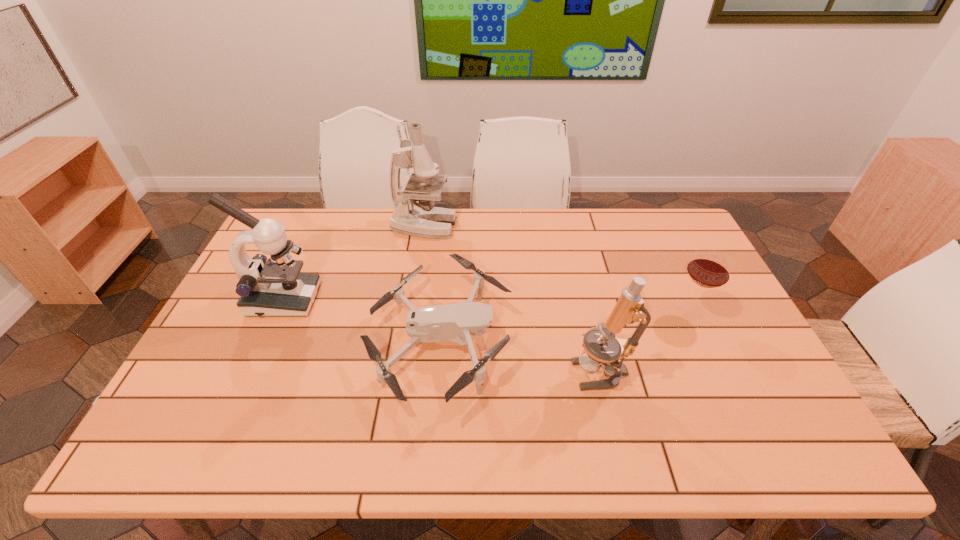
You are a GUI agent. You are given a task and a screenshot of the screen. Output one action in this format:
    pyautogui.click(x=<x>, y=<y>)
    Task: Click on the vacant space located on the right of the second farthest microscope
    
    Given the screenshot: What is the action you would take?
    pyautogui.click(x=363, y=300)

What are the coordinates of `blank space located 0.270m on the right of the second object from right to left` in the screenshot? It's located at (737, 371).

Find the location of a particular element. The width and height of the screenshot is (960, 540). free space located 0.370m on the back of the second shortest object is located at coordinates click(x=650, y=224).

Identify the location of free spot located 0.090m with a camera at the front of the drone. (545, 343).

You are a GUI agent. You are given a task and a screenshot of the screen. Output one action in this format:
    pyautogui.click(x=<x>, y=<y>)
    Task: Click on the object located at the far edge
    
    Given the screenshot: What is the action you would take?
    pyautogui.click(x=424, y=220)

At what (x,y) coordinates should I click in order to perform the action: click on object positioned at the near edge. Please return your answer as a coordinate pair (x, y). The width and height of the screenshot is (960, 540). Looking at the image, I should click on (451, 322).

I want to click on object at the left edge, so click(x=267, y=287).

Locate an element on the screen. This screenshot has width=960, height=540. object located at the right edge is located at coordinates (709, 268).

The height and width of the screenshot is (540, 960). I want to click on vacant space at the far edge, so click(371, 246).

I want to click on vacant area at the near edge, so click(x=661, y=457).